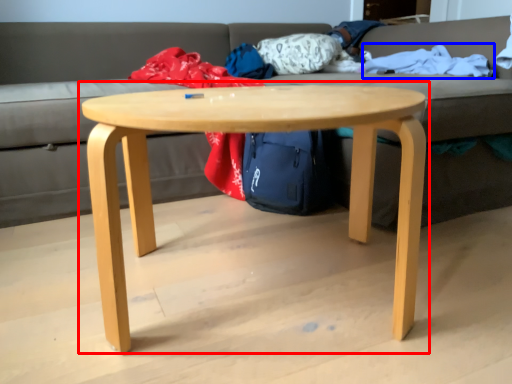
Question: Which point is closer to the camera, coffee table (highlighted by a red box) or blanket (highlighted by a blue box)?

Choices:
 (A) coffee table
 (B) blanket

Answer: (A)